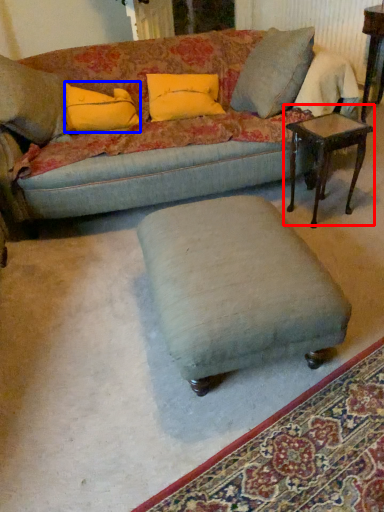
Question: Which point is closer to the camera, table (highlighted by a red box) or pillow (highlighted by a blue box)?

Choices:
 (A) table
 (B) pillow

Answer: (A)